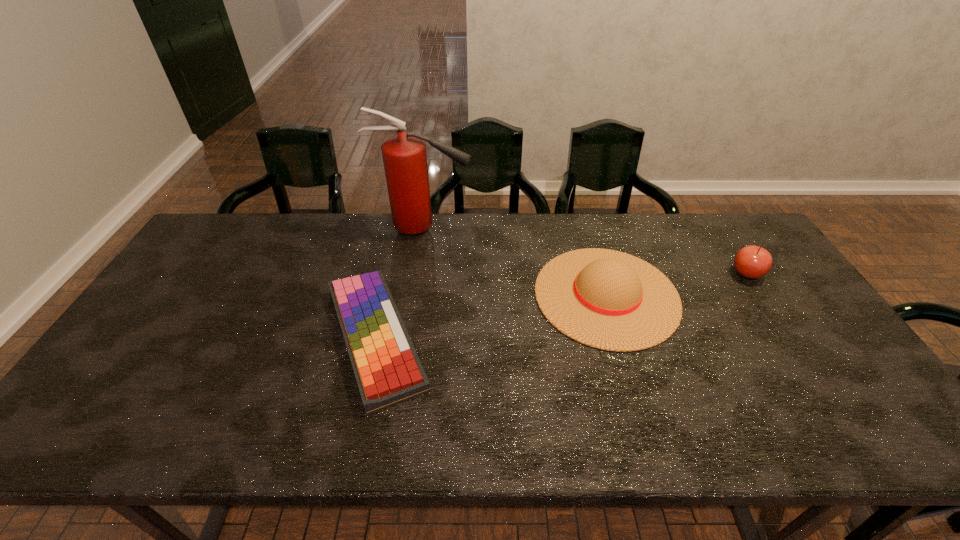
Where is `bonnet that is at the far edge`? Image resolution: width=960 pixels, height=540 pixels. bonnet that is at the far edge is located at coordinates (610, 300).

The image size is (960, 540). Identify the location of object present at the near edge. (387, 369).

You are a GUI agent. You are given a task and a screenshot of the screen. Output one action in this format:
    pyautogui.click(x=<x>, y=<y>)
    Task: Click on the object that is at the right edge
    Image resolution: width=960 pixels, height=540 pixels.
    Given the screenshot: What is the action you would take?
    pyautogui.click(x=752, y=262)

You are a GUI agent. You are given a task and a screenshot of the screen. Output one action in this format:
    pyautogui.click(x=<x>, y=<y>)
    Task: Click on the free spot at the far edge of the desktop
    The width and height of the screenshot is (960, 540).
    Given the screenshot: What is the action you would take?
    pyautogui.click(x=570, y=249)

Find the location of `free space at the near edge of the desktop`. free space at the near edge of the desktop is located at coordinates (396, 425).

The image size is (960, 540). What are the coordinates of `vacant space at the left edge of the desktop` in the screenshot? It's located at (212, 295).

Find the location of a particular element. This screenshot has height=540, width=960. vacant area at the right edge of the desktop is located at coordinates (852, 404).

Locate an element on the screen. The width and height of the screenshot is (960, 540). vacant space at the far right corner of the desktop is located at coordinates (735, 251).

Image resolution: width=960 pixels, height=540 pixels. Find the location of `free space between the computer keyboard and the bonnet`. free space between the computer keyboard and the bonnet is located at coordinates (491, 316).

At what (x,y) coordinates should I click in order to perform the action: click on empty space between the shortest object and the second object from right to left. Please return your answer as a coordinate pair (x, y). The image size is (960, 540). Looking at the image, I should click on (491, 316).